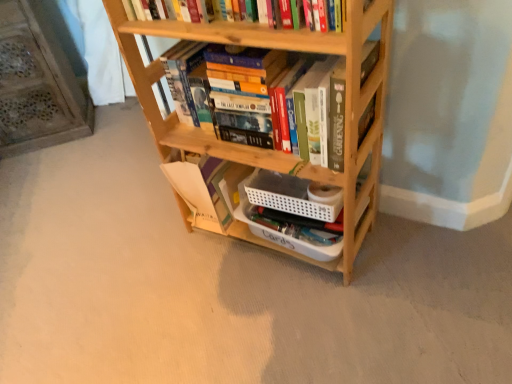
Question: Is natural wood bookcase at center turned away from wooden bookshelf at center?

Choices:
 (A) yes
 (B) no

Answer: (A)

Question: Is wooden bookshelf at center located within natural wood bookcase at center?

Choices:
 (A) no
 (B) yes

Answer: (B)

Question: Does natural wood bookcase at center have a smaller size compared to wooden bookshelf at center?

Choices:
 (A) yes
 (B) no

Answer: (B)

Question: Does natural wood bookcase at center have a larger size compared to wooden bookshelf at center?

Choices:
 (A) yes
 (B) no

Answer: (A)

Question: Are natural wood bookcase at center and wooden bookshelf at center far apart?

Choices:
 (A) yes
 (B) no

Answer: (B)

Question: Considering the relative positions of natural wood bookcase at center and wooden bookshelf at center in the image provided, is natural wood bookcase at center to the left of wooden bookshelf at center from the viewer's perspective?

Choices:
 (A) no
 (B) yes

Answer: (A)

Question: Considering the relative sizes of natural wood bookcase at center and wooden bookshelf at left in the image provided, is natural wood bookcase at center wider than wooden bookshelf at left?

Choices:
 (A) no
 (B) yes

Answer: (A)

Question: Does natural wood bookcase at center come behind wooden bookshelf at left?

Choices:
 (A) yes
 (B) no

Answer: (B)

Question: Does natural wood bookcase at center come in front of wooden bookshelf at left?

Choices:
 (A) no
 (B) yes

Answer: (B)

Question: Does natural wood bookcase at center turn towards wooden bookshelf at left?

Choices:
 (A) no
 (B) yes

Answer: (A)

Question: Is wooden bookshelf at left at the back of natural wood bookcase at center?

Choices:
 (A) no
 (B) yes

Answer: (A)

Question: From the image's perspective, is natural wood bookcase at center under wooden bookshelf at left?

Choices:
 (A) yes
 (B) no

Answer: (A)

Question: Can you confirm if wooden bookshelf at left is thinner than wooden bookshelf at center?

Choices:
 (A) no
 (B) yes

Answer: (A)